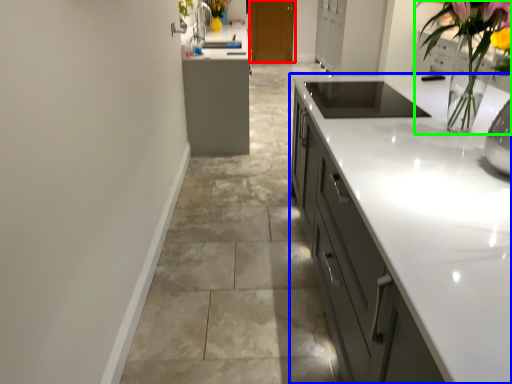
Question: Considering the real-world distances, which object is closest to cabinetry (highlighted by a red box)? cabinetry (highlighted by a blue box) or floral arrangement (highlighted by a green box).

Choices:
 (A) cabinetry
 (B) floral arrangement

Answer: (A)